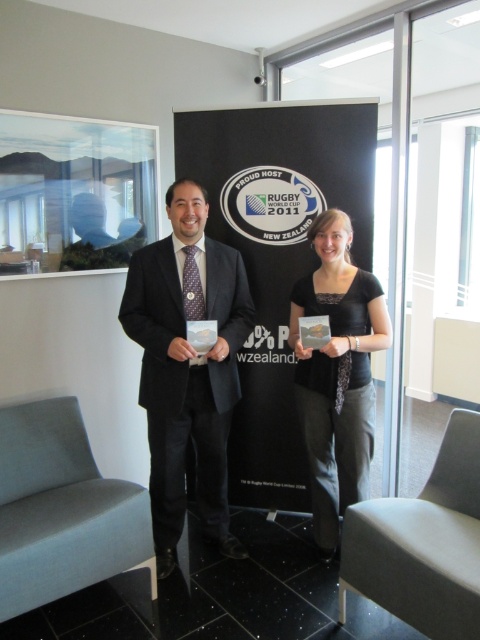
You are organizing a photo shoot and need to ensure that the black suit at center and the black textured shirt at center are visible in the final image. Given that the camera can only focus on objects within a 1.2 meter width, will both items fit within this focus range?

The black suit at center is bigger than the black textured shirt at center, but without specific measurements, it is impossible to determine if both will fit within the 1.2 meter width focus range. Additional information about their exact sizes is needed.

You are a photographer setting up for a group photo. You need to ensure that the black suit at center and the black textured shirt at center are both in focus. The camera you are using has a depth of field that can cover 18 inches. Can both subjects be in focus simultaneously?

The distance between the black suit at center and the black textured shirt at center is 17.54 inches, which is within the 18 inches depth of field. Therefore, both subjects can be in focus simultaneously.